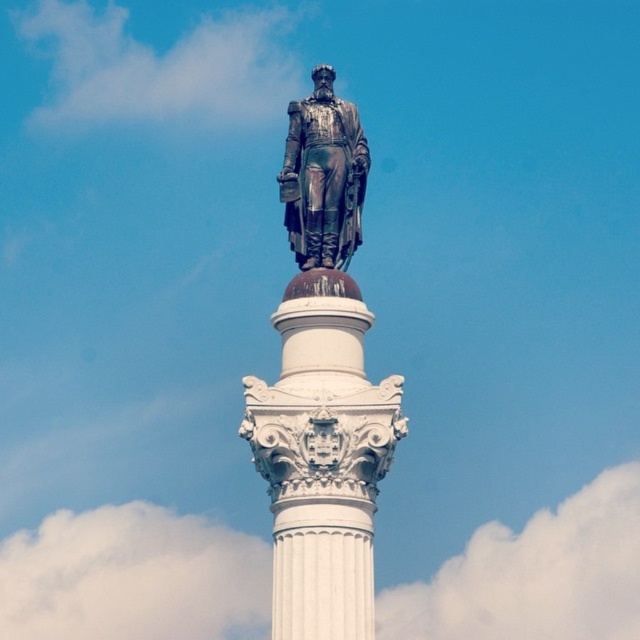
You are an art student standing in front of the white marble column at center and the bronze statue at center. Which object is closer to you?

The white marble column at center is closer to you because it is in front of the bronze statue at center.